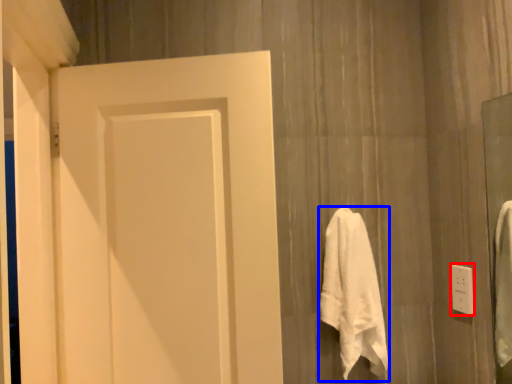
Question: Which of the following is the farthest to the observer, electric outlet (highlighted by a red box) or towel (highlighted by a blue box)?

Choices:
 (A) electric outlet
 (B) towel

Answer: (A)